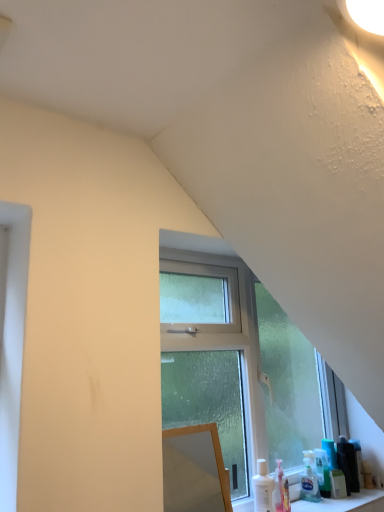
Question: Is green plastic bottle at lower right, which is the third toiletry from left to right, taller than wooden mirror at center?

Choices:
 (A) no
 (B) yes

Answer: (A)

Question: From a real-world perspective, is green plastic bottle at lower right, positioned as the second toiletry in right-to-left order, physically below wooden mirror at center?

Choices:
 (A) yes
 (B) no

Answer: (A)

Question: Is green plastic bottle at lower right, which is the third toiletry from left to right, to the right of wooden mirror at center from the viewer's perspective?

Choices:
 (A) yes
 (B) no

Answer: (A)

Question: Is the depth of green plastic bottle at lower right, which is the third toiletry from left to right, less than that of wooden mirror at center?

Choices:
 (A) no
 (B) yes

Answer: (A)

Question: Is green plastic bottle at lower right, which is the third toiletry from left to right, located outside wooden mirror at center?

Choices:
 (A) yes
 (B) no

Answer: (A)

Question: From a real-world perspective, relative to clear glass window at center, is green plastic bottle at lower right, which is the third toiletry from left to right, vertically above or below?

Choices:
 (A) below
 (B) above

Answer: (A)

Question: Is green plastic bottle at lower right, which is the third toiletry from left to right, to the left or to the right of clear glass window at center in the image?

Choices:
 (A) left
 (B) right

Answer: (B)

Question: Is green plastic bottle at lower right, positioned as the second toiletry in right-to-left order, inside the boundaries of clear glass window at center, or outside?

Choices:
 (A) outside
 (B) inside

Answer: (A)

Question: Is point (352, 446) positioned closer to the camera than point (304, 347)?

Choices:
 (A) closer
 (B) farther

Answer: (A)

Question: Is clear glass window at center situated inside translucent plastic soap dispenser at lower right, acting as the fourth toiletry starting from the right, or outside?

Choices:
 (A) inside
 (B) outside

Answer: (B)

Question: Considering the positions of point (190, 304) and point (316, 497), is point (190, 304) closer or farther from the camera than point (316, 497)?

Choices:
 (A) closer
 (B) farther

Answer: (A)

Question: Based on their sizes in the image, would you say clear glass window at center is bigger or smaller than translucent plastic soap dispenser at lower right, the 1th toiletry viewed from the left?

Choices:
 (A) big
 (B) small

Answer: (A)

Question: In terms of height, does clear glass window at center look taller or shorter compared to translucent plastic soap dispenser at lower right, acting as the fourth toiletry starting from the right?

Choices:
 (A) short
 (B) tall

Answer: (B)

Question: Based on their sizes in the image, would you say matte black hairbrush at lower right, positioned as the 4th toiletry in left-to-right order, is bigger or smaller than green plastic bottle at lower right, which is the third toiletry from left to right?

Choices:
 (A) big
 (B) small

Answer: (B)

Question: Considering the positions of matte black hairbrush at lower right, positioned as the 4th toiletry in left-to-right order, and green plastic bottle at lower right, which is the third toiletry from left to right, in the image, is matte black hairbrush at lower right, positioned as the 4th toiletry in left-to-right order, wider or thinner than green plastic bottle at lower right, which is the third toiletry from left to right,?

Choices:
 (A) wide
 (B) thin

Answer: (B)